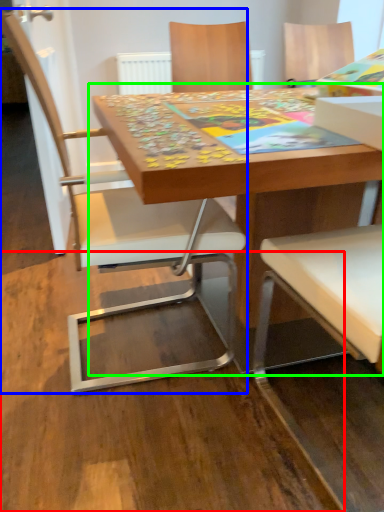
Question: Considering the real-world distances, which object is farthest from plywood (highlighted by a red box)? chair (highlighted by a blue box) or table (highlighted by a green box)?

Choices:
 (A) chair
 (B) table

Answer: (B)